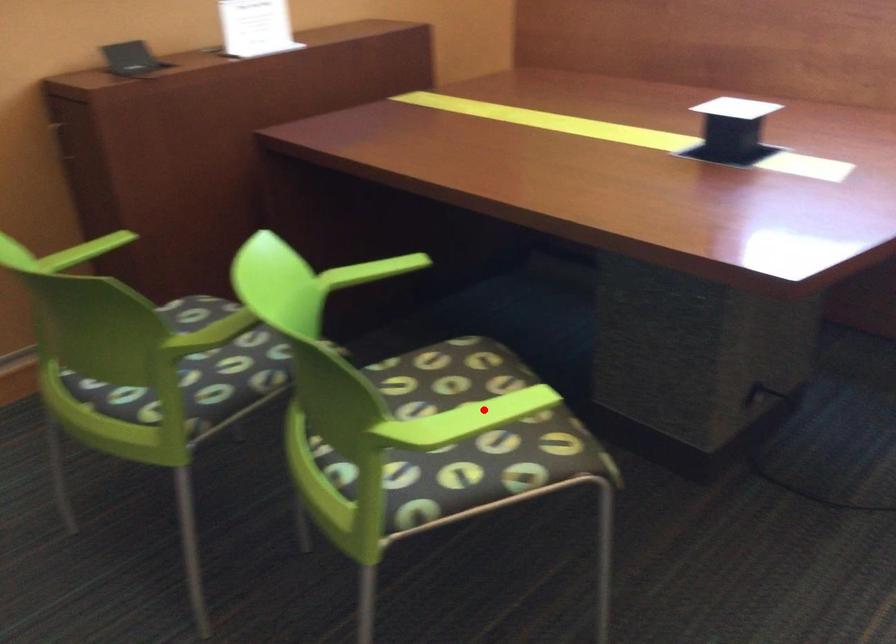
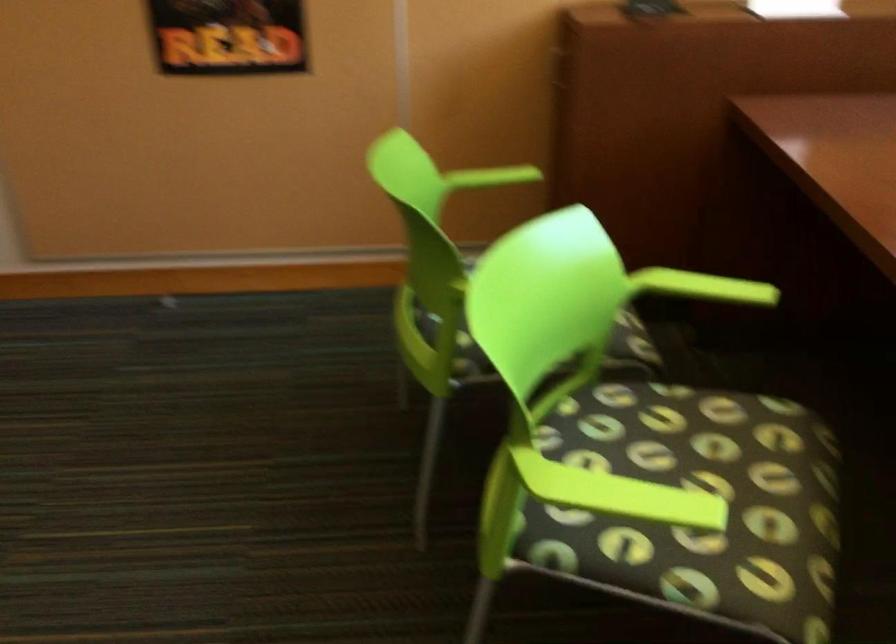
Question: I am providing you with two images of the same scene from different viewpoints. A red point is shown in image1. For the corresponding object point in image2, is it positioned nearer or farther from the camera?

Choices:
 (A) Nearer
 (B) Farther

Answer: (A)